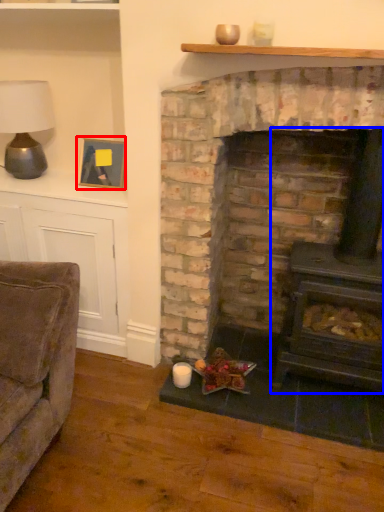
Question: Which of the following is the farthest to the observer, picture frame (highlighted by a red box) or wood burning stove (highlighted by a blue box)?

Choices:
 (A) picture frame
 (B) wood burning stove

Answer: (A)